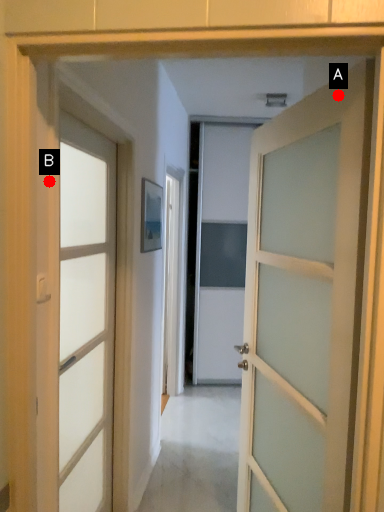
Question: Two points are circled on the image, labeled by A and B beside each circle. Which of the following is the farthest from the observer?

Choices:
 (A) A is further
 (B) B is further

Answer: (B)